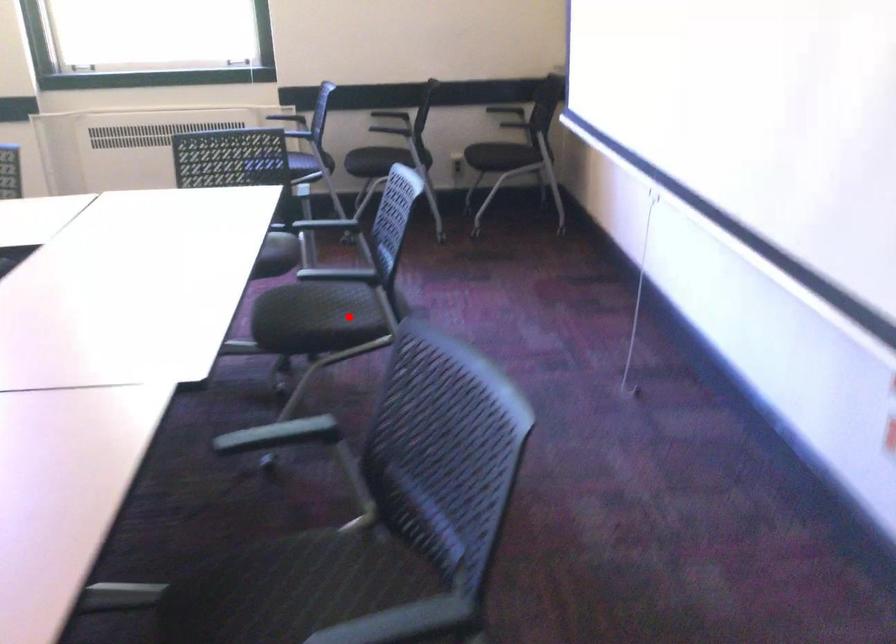
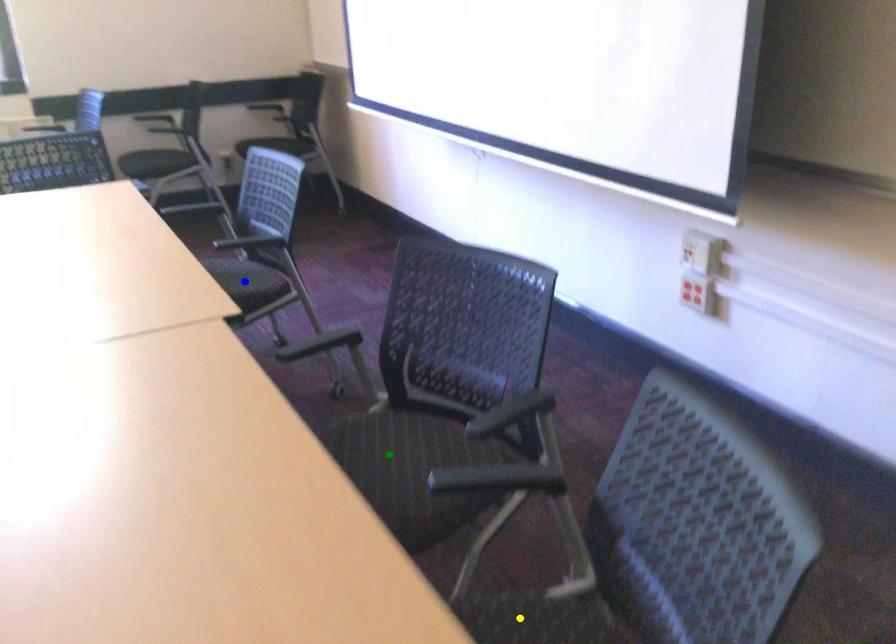
Question: I am providing you with two images of the same scene from different viewpoints. A red point is marked on the first image. You are given multiple points on the second image. Which point in image 2 represents the same 3d spot as the red point in image 1?

Choices:
 (A) yellow point
 (B) blue point
 (C) green point

Answer: (B)